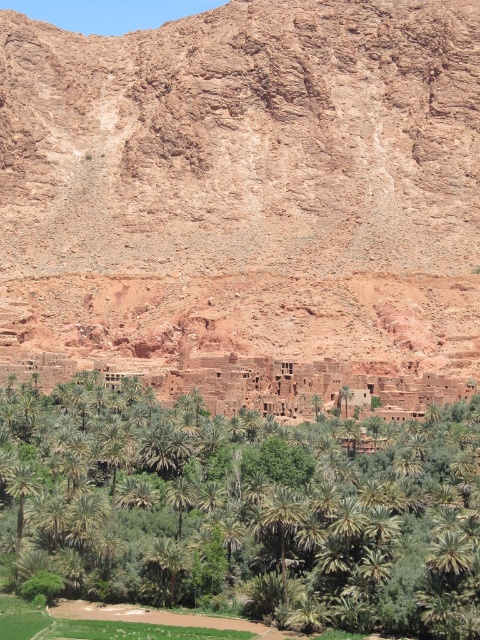
Question: Which object is farther from the camera taking this photo?

Choices:
 (A) green leafy palm tree at lower left
 (B) green leafy palm at center

Answer: (A)

Question: Is green leafy palm at center below green leafy palm tree at lower left?

Choices:
 (A) yes
 (B) no

Answer: (B)

Question: Does green leafy palm at center appear under green leafy palm tree at lower left?

Choices:
 (A) yes
 (B) no

Answer: (B)

Question: Which object is the closest to the green leafy palm tree at lower left?

Choices:
 (A) brown rock formation at center
 (B) green leafy palm at center

Answer: (B)

Question: Considering the real-world distances, which object is closest to the brown rock formation at center?

Choices:
 (A) green leafy palm tree at lower left
 (B) green leafy palm at center

Answer: (B)

Question: Does green leafy palm at center appear on the left side of green leafy palm tree at lower left?

Choices:
 (A) yes
 (B) no

Answer: (B)